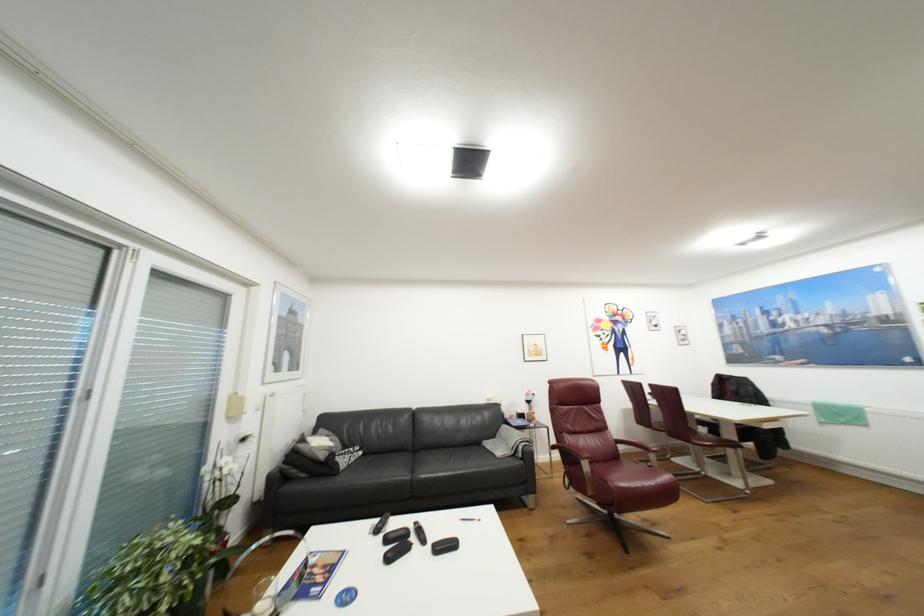
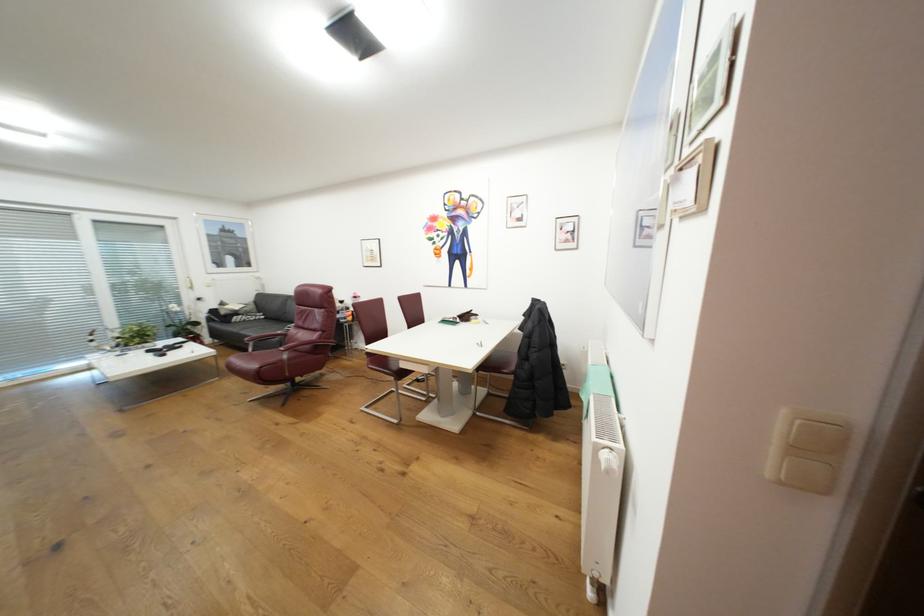
Where in the second image is the point corresponding to (349,462) from the first image?

(244, 318)